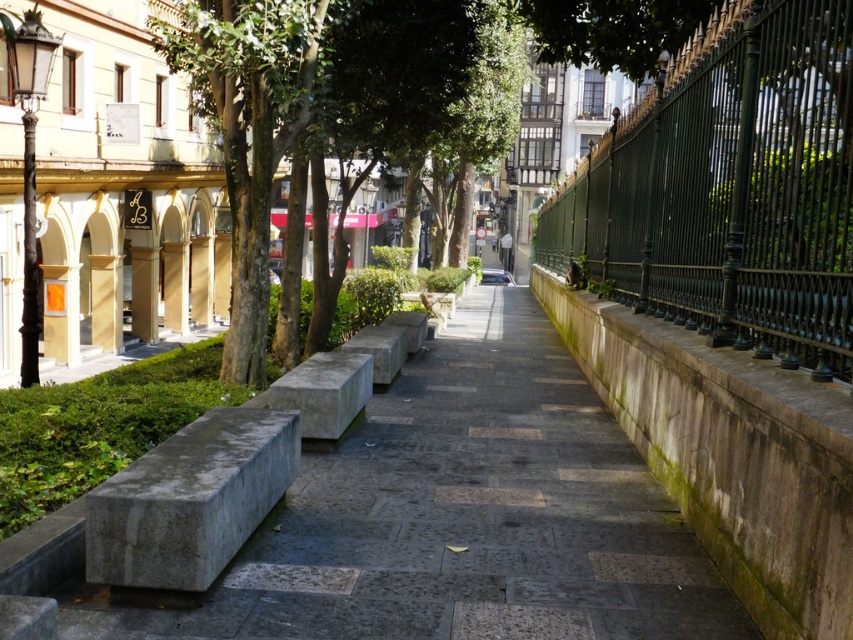
Question: Can you confirm if green leafy tree at upper left is thinner than gray concrete bench at center?

Choices:
 (A) no
 (B) yes

Answer: (A)

Question: Which point is closer to the camera?

Choices:
 (A) green leafy tree at upper left
 (B) gray stone pavement at center
 (C) gray concrete bench at center

Answer: (B)

Question: Can you confirm if gray stone pavement at center is smaller than gray concrete bench at center?

Choices:
 (A) yes
 (B) no

Answer: (B)

Question: Does green leafy tree at upper left appear over gray concrete bench at center?

Choices:
 (A) no
 (B) yes

Answer: (B)

Question: Which point is closer to the camera taking this photo?

Choices:
 (A) (840, 52)
 (B) (544, 342)
 (C) (219, 93)

Answer: (A)

Question: Which point is closer to the camera?

Choices:
 (A) (412, 467)
 (B) (827, 28)
 (C) (252, 260)

Answer: (B)